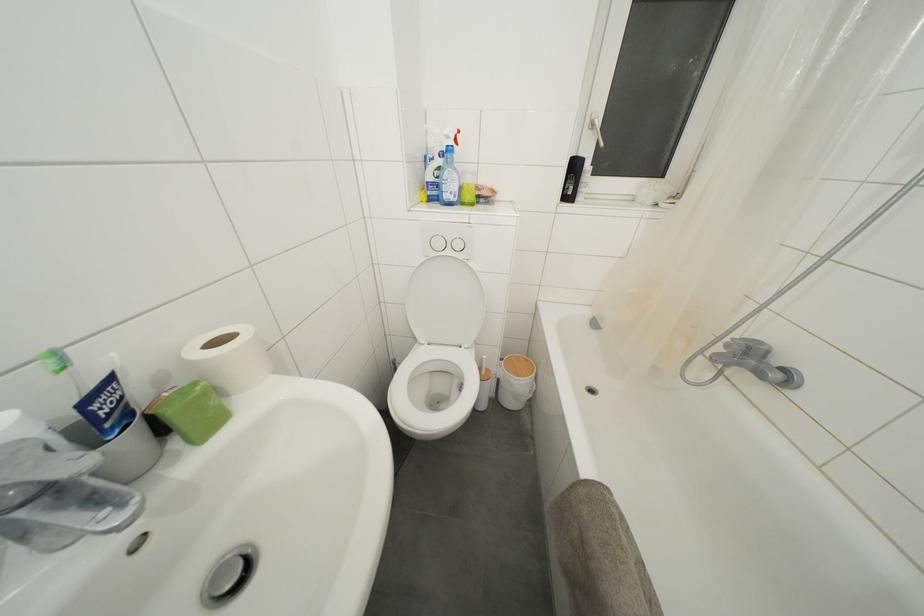
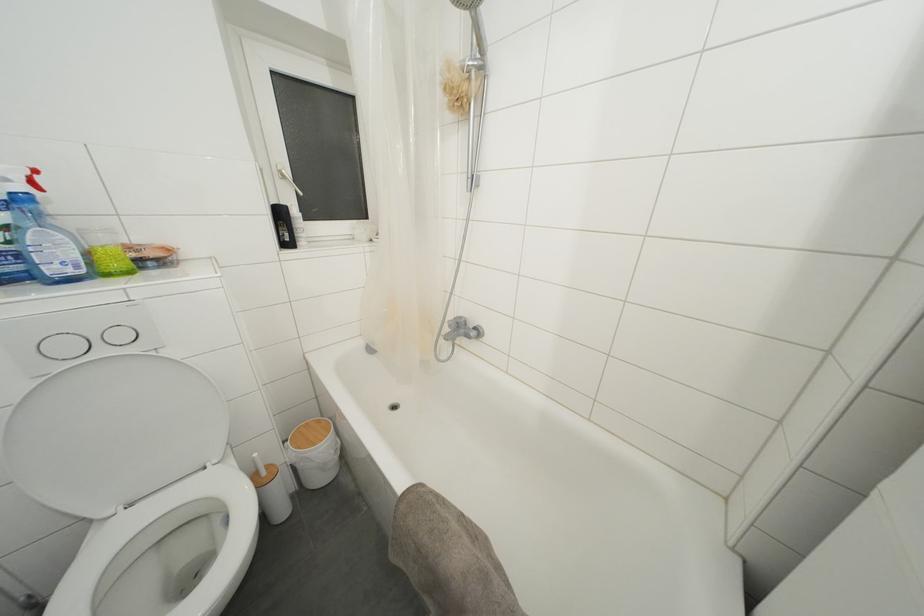
Where in the second image is the point corresponding to point (443, 249) from the first image?

(71, 352)